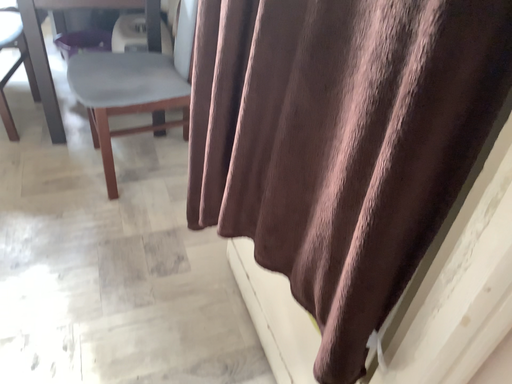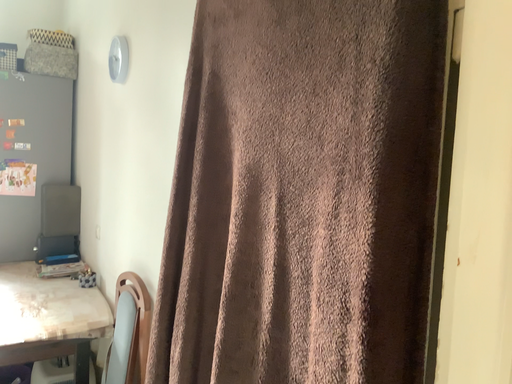
Question: How did the camera likely rotate when shooting the video?

Choices:
 (A) rotated downward
 (B) rotated upward

Answer: (B)